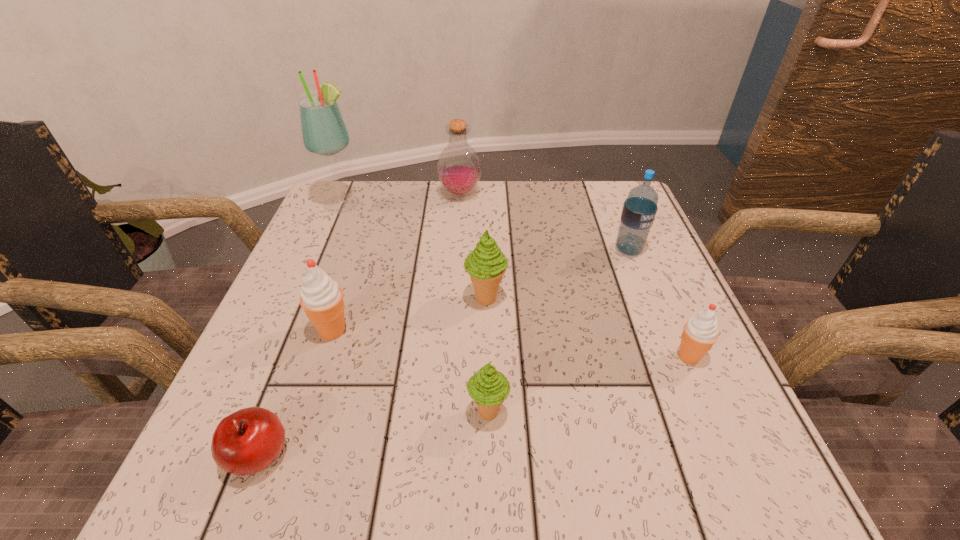
Select which icecream is the second closest to the tallest object. Please provide its 2D coordinates. Your answer should be formatted as a tuple, i.e. [(x, y)], where the tuple contains the x and y coordinates of a point satisfying the conditions above.

[(486, 264)]

Where is `vacant space that satisfies the following two spatial constraints: 1. on the front side of the farther green icecream; 2. on the left side of the nearest icecream`? vacant space that satisfies the following two spatial constraints: 1. on the front side of the farther green icecream; 2. on the left side of the nearest icecream is located at coordinates (487, 413).

Locate an element on the screen. The width and height of the screenshot is (960, 540). blank space that satisfies the following two spatial constraints: 1. on the front side of the alcohol; 2. on the right side of the apple is located at coordinates (239, 455).

Where is `free space in the image that satisfies the following two spatial constraints: 1. on the front side of the third farthest object; 2. on the right side of the smaller red icecream`? The height and width of the screenshot is (540, 960). free space in the image that satisfies the following two spatial constraints: 1. on the front side of the third farthest object; 2. on the right side of the smaller red icecream is located at coordinates [x=671, y=356].

Where is `free spot that satisfies the following two spatial constraints: 1. on the back side of the nearest icecream; 2. on the right side of the sixth nearest object`? The height and width of the screenshot is (540, 960). free spot that satisfies the following two spatial constraints: 1. on the back side of the nearest icecream; 2. on the right side of the sixth nearest object is located at coordinates (486, 250).